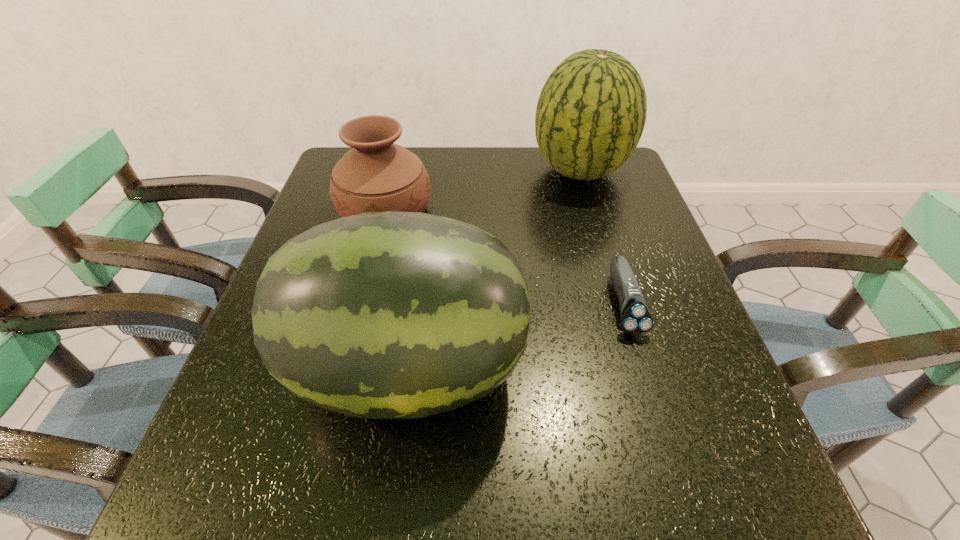
In order to click on watermelon that is at the left edge in this screenshot , I will do `click(383, 315)`.

Where is `urn that is at the left edge`? The height and width of the screenshot is (540, 960). urn that is at the left edge is located at coordinates (376, 175).

What are the coordinates of `watermelon located at the right edge` in the screenshot? It's located at click(x=591, y=112).

Where is `electric shaver located at the right edge`? Image resolution: width=960 pixels, height=540 pixels. electric shaver located at the right edge is located at coordinates (635, 318).

Locate an element on the screen. The width and height of the screenshot is (960, 540). object located at the far left corner is located at coordinates (376, 175).

The image size is (960, 540). In order to click on object present at the far right corner in this screenshot , I will do `click(591, 112)`.

In the image, there is a desktop. Find the location of `vacant space at the far edge`. vacant space at the far edge is located at coordinates (488, 153).

This screenshot has height=540, width=960. In order to click on free space at the near edge of the desktop in this screenshot , I will do `click(577, 471)`.

Where is `free space at the left edge`? This screenshot has height=540, width=960. free space at the left edge is located at coordinates (197, 461).

What are the coordinates of `vacant region at the right edge` in the screenshot? It's located at (677, 294).